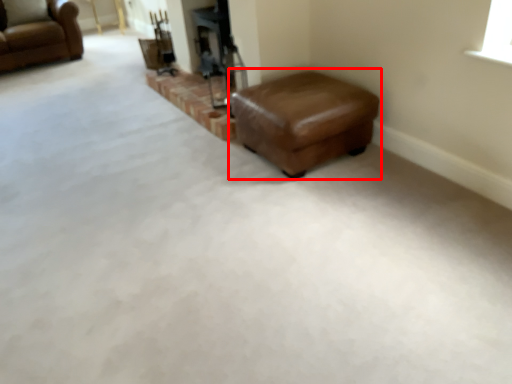
Question: In this image, where is stool (annotated by the red box) located relative to chair?

Choices:
 (A) right
 (B) left

Answer: (A)